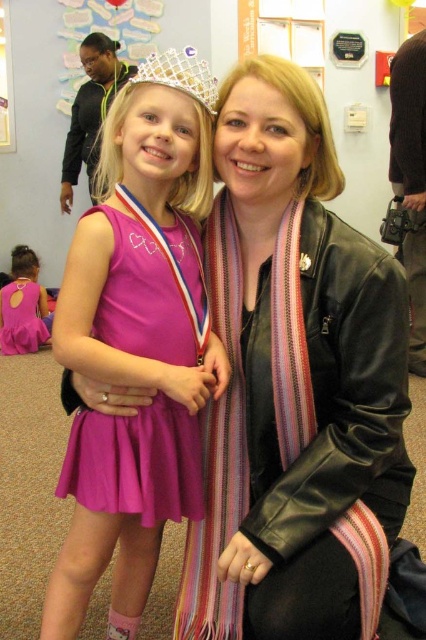
Question: Based on their relative distances, which object is nearer to the pink satin dress at lower left?

Choices:
 (A) purple satin dress at center
 (B) matte black jacket at upper left

Answer: (B)

Question: Which of the following is the farthest from the observer?

Choices:
 (A) purple satin dress at center
 (B) black leather jacket at center
 (C) pink satin dress at lower left
 (D) glittery plastic crown at upper center

Answer: (C)

Question: Considering the real-world distances, which object is closest to the pink satin dress at lower left?

Choices:
 (A) purple satin dress at center
 (B) matte pink dress at center
 (C) black leather jacket at center

Answer: (B)

Question: Can you confirm if pink satin dress at lower left is wider than glittery plastic crown at upper center?

Choices:
 (A) no
 (B) yes

Answer: (B)

Question: Is black leather jacket at center closer to the viewer compared to pink satin dress at lower left?

Choices:
 (A) yes
 (B) no

Answer: (A)

Question: Can you confirm if matte black jacket at upper left is bigger than pink satin dress at lower left?

Choices:
 (A) yes
 (B) no

Answer: (A)